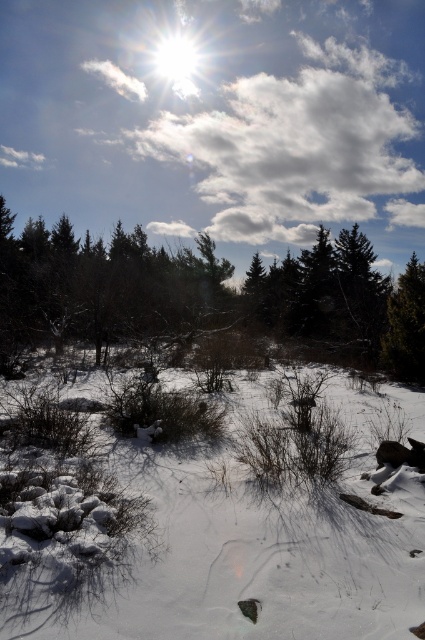
You are standing in the winter landscape and want to walk to the green matte tree at right. Which direction should you move to get closer to it, considering the white powdery snow at center is between you and the tree?

To reach the green matte tree at right, you should move away from the white powdery snow at center, as it is closer to you than the tree, indicating the tree is further back. Walk in the direction opposite the snow to approach the tree.